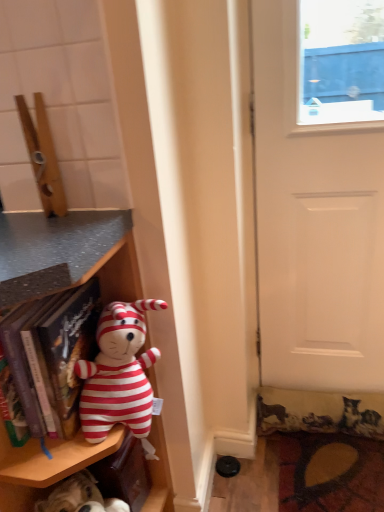
The width and height of the screenshot is (384, 512). Describe the element at coordinates (67, 255) in the screenshot. I see `matte plastic shelf at left` at that location.

Measure the distance between hardcover book at left and camera.

The depth of hardcover book at left is 29.38 inches.

Find the location of a particular element. The height and width of the screenshot is (512, 384). matte plastic shelf at left is located at coordinates (67, 255).

How much distance is there between striped fabric plush toy at left and hardcover book at left?

striped fabric plush toy at left and hardcover book at left are 3.24 inches apart.

Is striped fabric plush toy at left facing away from hardcover book at left?

No, striped fabric plush toy at left is not facing away from hardcover book at left.

Between striped fabric plush toy at left and hardcover book at left, which one has larger size?

With larger size is hardcover book at left.

From the image's perspective, is striped fabric plush toy at left positioned above or below hardcover book at left?

striped fabric plush toy at left is situated lower than hardcover book at left in the image.

Is white matte door at right behind matte plastic shelf at left?

Yes, white matte door at right is behind matte plastic shelf at left.

From a real-world perspective, between white matte door at right and matte plastic shelf at left, who is vertically higher?

white matte door at right, from a real-world perspective.

Could you tell me if white matte door at right is turned towards matte plastic shelf at left?

No, white matte door at right is not facing towards matte plastic shelf at left.

Is white matte door at right next to matte plastic shelf at left and touching it?

No, white matte door at right is not next to matte plastic shelf at left.

Are hardcover book at left and fluffy carpet at lower right making contact?

No, hardcover book at left is not beside fluffy carpet at lower right.

From the image's perspective, would you say hardcover book at left is positioned over fluffy carpet at lower right?

Yes.

Can you confirm if hardcover book at left is positioned to the left of fluffy carpet at lower right?

Yes.

Who is bigger, matte plastic shelf at left or hardcover book at left?

Bigger between the two is matte plastic shelf at left.

What are the coordinates of `book above the matte plastic shelf at left (from the image's perspective)` in the screenshot? It's located at (52, 356).

Is matte plastic shelf at left touching hardcover book at left?

No.

From the image's perspective, which object appears higher, matte plastic shelf at left or hardcover book at left?

From the image's view, hardcover book at left is above.

Considering the positions of point (293, 340) and point (58, 360), is point (293, 340) closer or farther from the camera than point (58, 360)?

Point (293, 340) appears to be farther away from the viewer than point (58, 360).

Is white matte door at right not inside hardcover book at left?

Yes.

From the image's perspective, which is above, white matte door at right or hardcover book at left?

white matte door at right.

Is white matte door at right oriented away from hardcover book at left?

No, white matte door at right is not facing away from hardcover book at left.

From a real-world perspective, is matte plastic shelf at left located higher than fluffy carpet at lower right?

Yes, from a real-world perspective, matte plastic shelf at left is over fluffy carpet at lower right

Would you say matte plastic shelf at left contains fluffy carpet at lower right?

No, fluffy carpet at lower right is not surrounded by matte plastic shelf at left.

Can you confirm if matte plastic shelf at left is thinner than fluffy carpet at lower right?

In fact, matte plastic shelf at left might be wider than fluffy carpet at lower right.

How many degrees apart are the facing directions of fluffy carpet at lower right and matte plastic shelf at left?

The angle between the facing direction of fluffy carpet at lower right and the facing direction of matte plastic shelf at left is 0.798 degrees.

Consider the image. Considering the relative sizes of fluffy carpet at lower right and matte plastic shelf at left in the image provided, is fluffy carpet at lower right thinner than matte plastic shelf at left?

Yes, fluffy carpet at lower right is thinner than matte plastic shelf at left.

Does fluffy carpet at lower right lie behind matte plastic shelf at left?

Yes.

At what (x,y) coordinates should I click in order to perform the action: click on book located above the striped fabric plush toy at left (from a real-world perspective). Please return your answer as a coordinate pair (x, y). Looking at the image, I should click on (52, 356).

Identify the location of shelf below the white matte door at right (from a real-world perspective). This screenshot has height=512, width=384. (67, 255).

Which object lies nearer to the anchor point matte plastic shelf at left, fluffy carpet at lower right or white matte door at right?

white matte door at right lies closer to matte plastic shelf at left than the other object.

When comparing their distances from fluffy carpet at lower right, does matte plastic shelf at left or white matte door at right seem closer?

The object closer to fluffy carpet at lower right is white matte door at right.

Which object lies further to the anchor point matte plastic shelf at left, white matte door at right or hardcover book at left?

white matte door at right lies further to matte plastic shelf at left than the other object.

Looking at this image, considering their positions, is fluffy carpet at lower right positioned closer to hardcover book at left than white matte door at right?

white matte door at right.

Estimate the real-world distances between objects in this image. Which object is further from white matte door at right, striped fabric plush toy at left or matte plastic shelf at left?

matte plastic shelf at left.

Which object lies further to the anchor point matte plastic shelf at left, fluffy carpet at lower right or striped fabric plush toy at left?

fluffy carpet at lower right is positioned further to the anchor matte plastic shelf at left.

Estimate the real-world distances between objects in this image. Which object is further from striped fabric plush toy at left, hardcover book at left or fluffy carpet at lower right?

The object further to striped fabric plush toy at left is fluffy carpet at lower right.

From the image, which object appears to be farther from fluffy carpet at lower right, white matte door at right or matte plastic shelf at left?

matte plastic shelf at left is positioned further to the anchor fluffy carpet at lower right.

This screenshot has height=512, width=384. Identify the location of toy between hardcover book at left and matte plastic shelf at left from top to bottom. (119, 374).

Identify the location of toy between hardcover book at left and white matte door at right. (119, 374).

This screenshot has height=512, width=384. In order to click on shelf located between hardcover book at left and white matte door at right in the left-right direction in this screenshot , I will do click(x=67, y=255).

Identify the location of toy situated between matte plastic shelf at left and white matte door at right from left to right. The height and width of the screenshot is (512, 384). (119, 374).